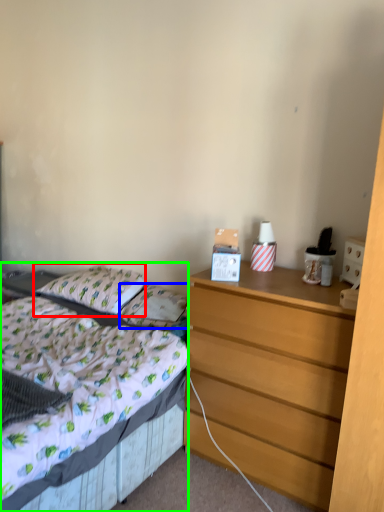
Question: Estimate the real-world distances between objects in this image. Which object is closer to pillow (highlighted by a red box), pillow (highlighted by a blue box) or bed (highlighted by a green box)?

Choices:
 (A) pillow
 (B) bed

Answer: (A)